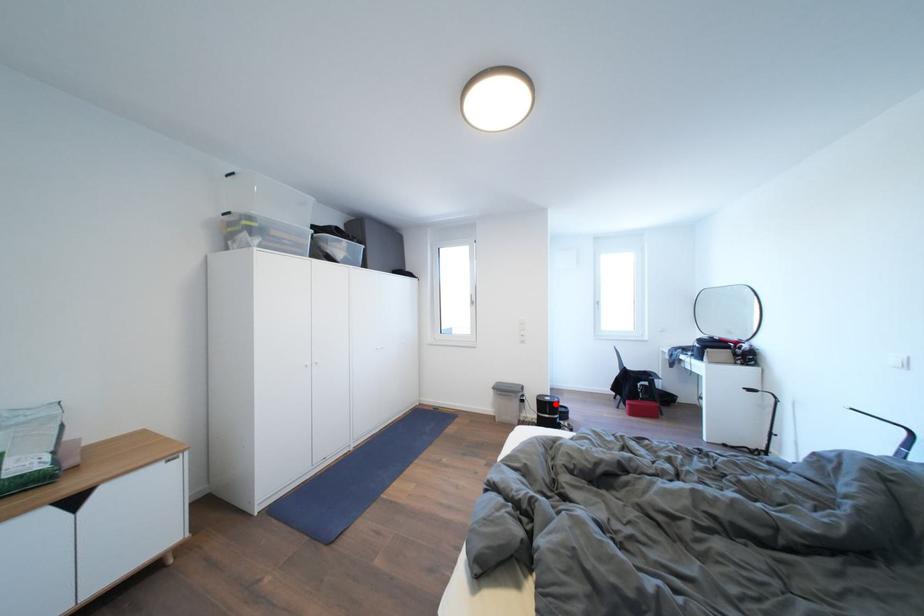
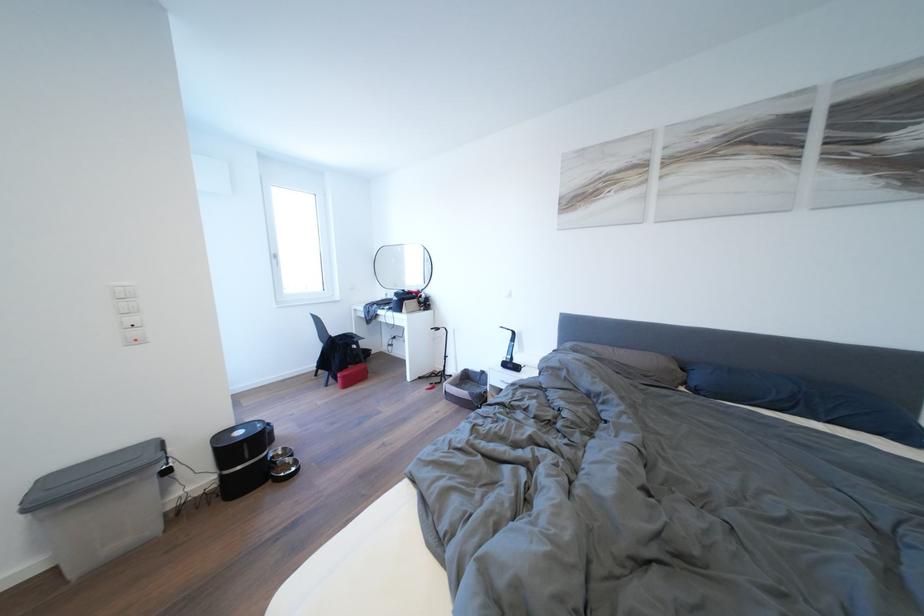
Find the pixel in the second image that matches the highlighted location in the first image.

(248, 438)